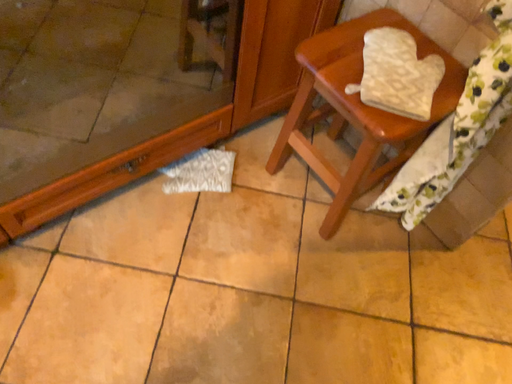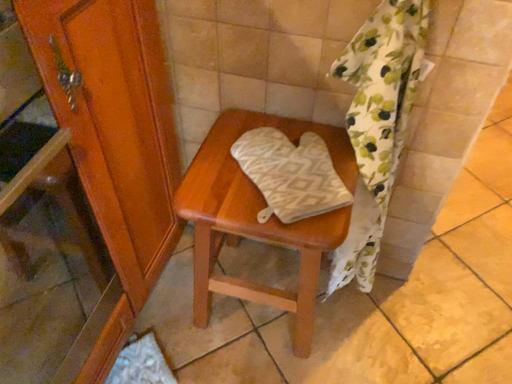
Question: Which way did the camera rotate in the video?

Choices:
 (A) rotated right
 (B) rotated left

Answer: (A)